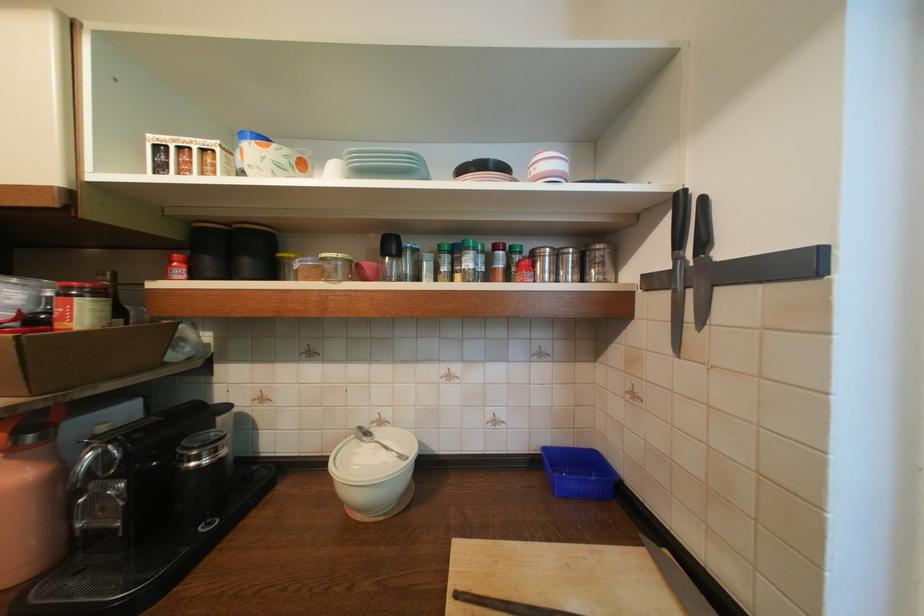
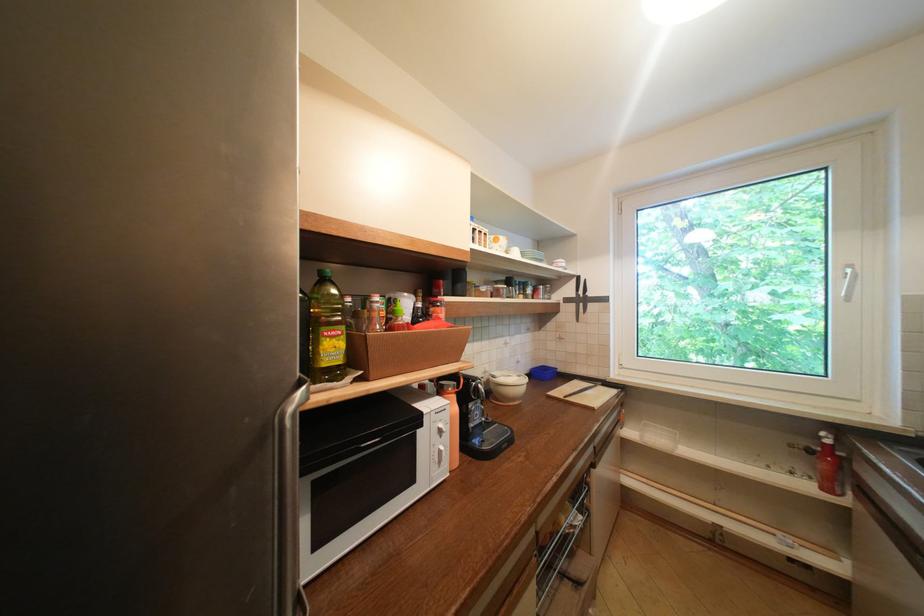
Find the pixel in the second image that matches the point at 661,283 in the first image.

(575, 301)